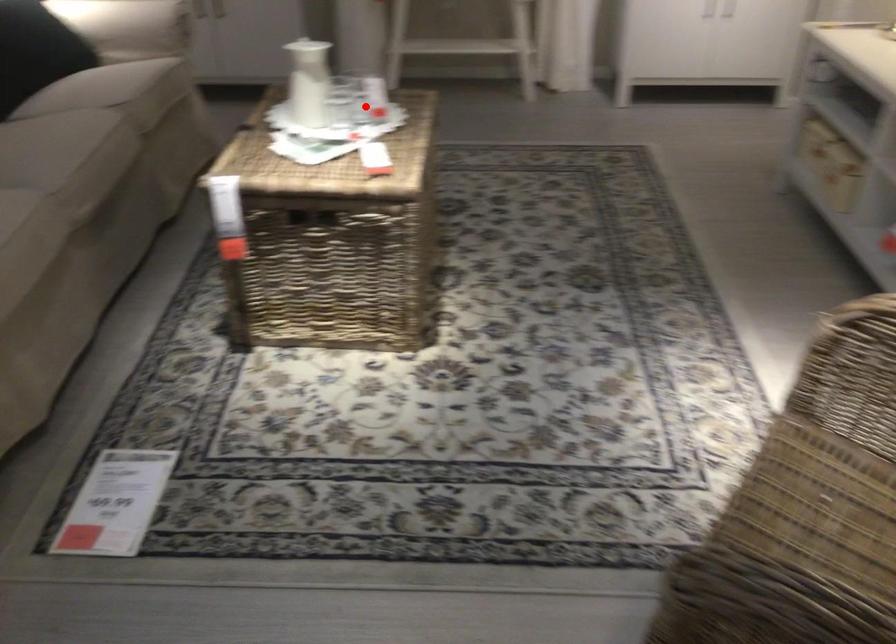
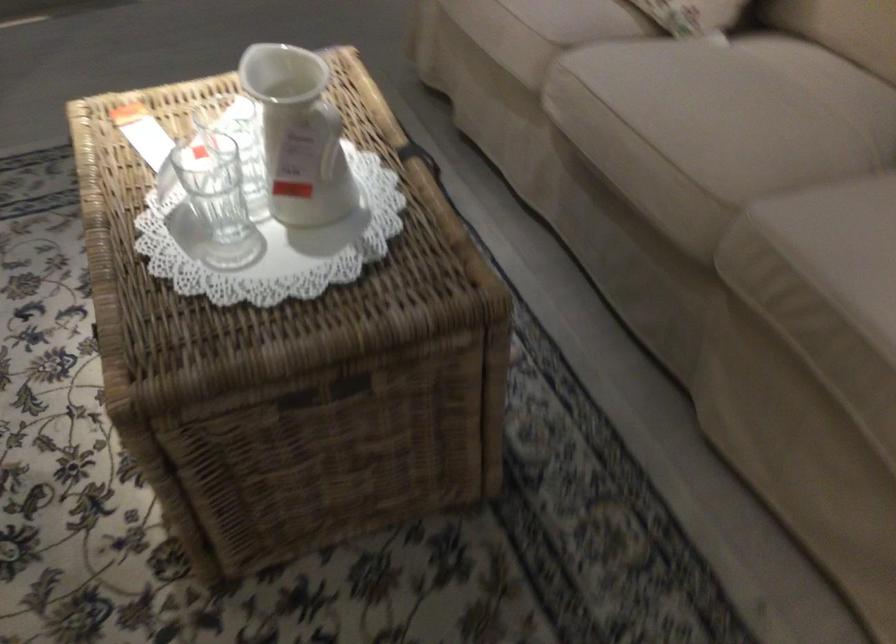
Question: A red point is marked in image1. In image2, is the corresponding 3D point closer to the camera or farther? Reply with the corresponding letter.

Choices:
 (A) The corresponding 3D point is closer.
 (B) The corresponding 3D point is farther.

Answer: (A)